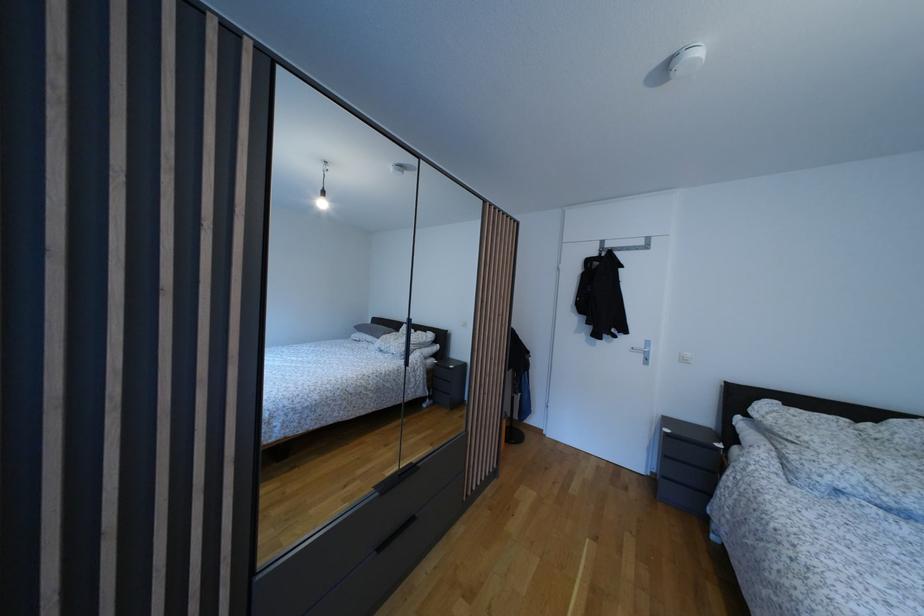
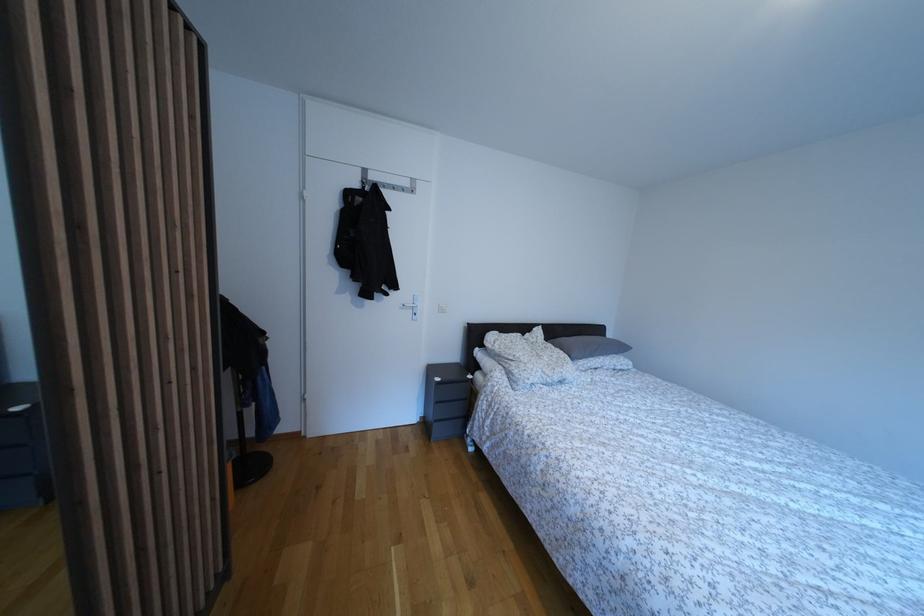
Question: How did the camera likely rotate?

Choices:
 (A) Left
 (B) Right
 (C) Up
 (D) Down

Answer: (B)